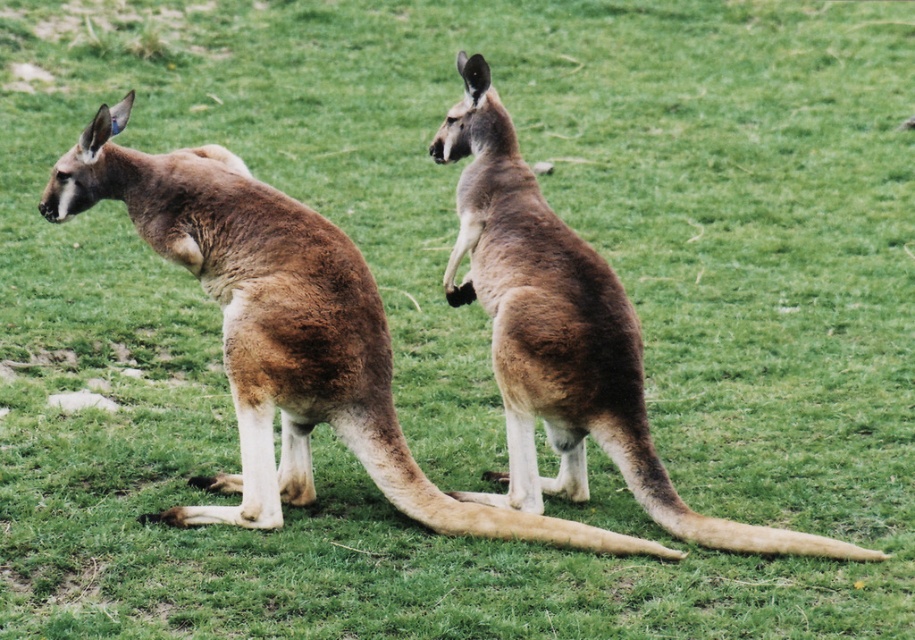
Question: Is brown furry kangaroo at left wider than brown furry kangaroo at center?

Choices:
 (A) no
 (B) yes

Answer: (B)

Question: Which point is farther from the camera taking this photo?

Choices:
 (A) (815, 547)
 (B) (268, 211)

Answer: (B)

Question: In this image, where is brown furry kangaroo at left located relative to brown furry kangaroo at center?

Choices:
 (A) below
 (B) above

Answer: (A)

Question: Can you confirm if brown furry kangaroo at left is positioned above brown furry kangaroo at center?

Choices:
 (A) yes
 (B) no

Answer: (B)

Question: Which of the following is the farthest from the observer?

Choices:
 (A) brown furry kangaroo at center
 (B) brown furry kangaroo at left

Answer: (A)